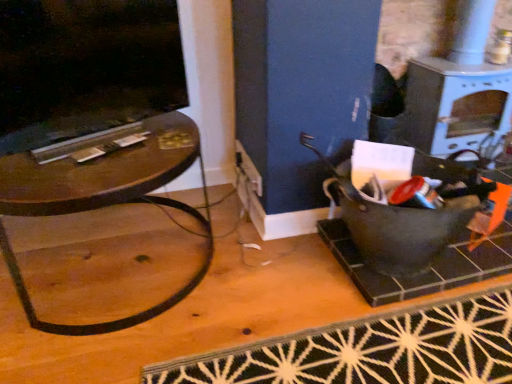
Question: From the image's perspective, relative to black woven mat at lower center, is black glossy fireplace at upper left above or below?

Choices:
 (A) above
 (B) below

Answer: (A)

Question: Is black glossy fireplace at upper left situated inside black woven mat at lower center or outside?

Choices:
 (A) inside
 (B) outside

Answer: (B)

Question: Which object is positioned closest to the brown wood table at left?

Choices:
 (A) black woven mat at lower center
 (B) white glossy stove at upper right
 (C) black glossy fireplace at upper left

Answer: (C)

Question: Based on their relative distances, which object is farther from the white glossy stove at upper right?

Choices:
 (A) black woven mat at lower center
 (B) black glossy fireplace at upper left
 (C) brown wood table at left

Answer: (B)